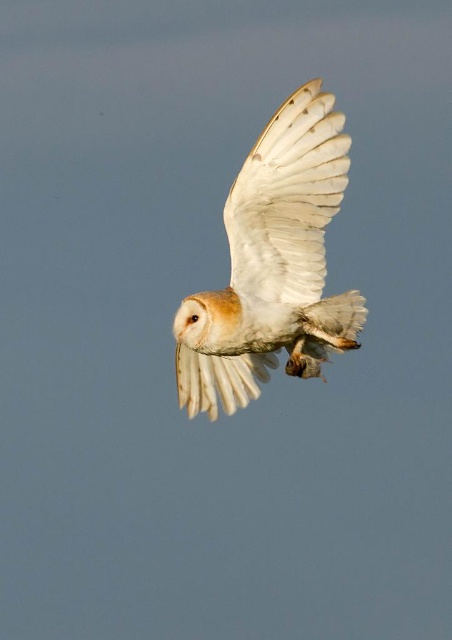
Question: Is white feathered owl at center closer to camera compared to white feathered wing at center?

Choices:
 (A) no
 (B) yes

Answer: (B)

Question: Does white feathered owl at center appear on the left side of white feathered wing at center?

Choices:
 (A) no
 (B) yes

Answer: (A)

Question: Which point is farther to the camera?

Choices:
 (A) (249, 163)
 (B) (277, 275)

Answer: (B)

Question: Which point is farther to the camera?

Choices:
 (A) (249, 289)
 (B) (259, 280)

Answer: (B)

Question: Does white feathered owl at center have a greater width compared to white feathered wing at center?

Choices:
 (A) no
 (B) yes

Answer: (B)